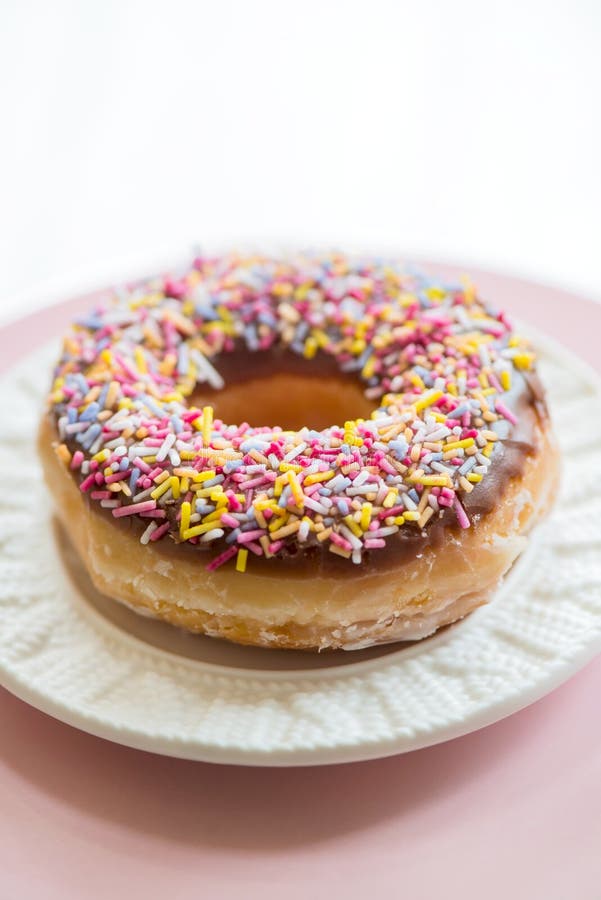
Find the location of a particular element. table is located at coordinates tap(343, 870).